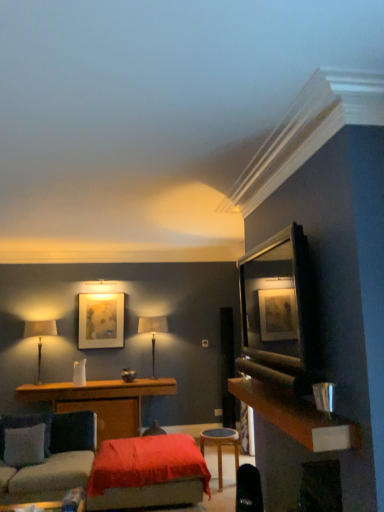
This screenshot has width=384, height=512. What do you see at coordinates (221, 446) in the screenshot? I see `wooden stool at center, marked as the second table in a left-to-right arrangement` at bounding box center [221, 446].

Describe the element at coordinates (24, 445) in the screenshot. This screenshot has width=384, height=512. I see `white fabric pillow at lower left` at that location.

This screenshot has height=512, width=384. Describe the element at coordinates (101, 401) in the screenshot. I see `wooden table at center, which is the 2th table in right-to-left order` at that location.

What do you see at coordinates (45, 455) in the screenshot? The height and width of the screenshot is (512, 384). I see `velvet blue couch at lower left` at bounding box center [45, 455].

The width and height of the screenshot is (384, 512). Describe the element at coordinates (278, 302) in the screenshot. I see `wooden framed mirror at upper right` at that location.

What is the approximate width of matte beige table lamp at left, positioned as the 1th table lamp in left-to-right order?

It is 25.21 centimeters.

The height and width of the screenshot is (512, 384). Describe the element at coordinates (147, 473) in the screenshot. I see `velvet red ottoman at center` at that location.

In order to click on wooden stool at center, the 1th table viewed from the front in this screenshot , I will do `click(221, 446)`.

Is white fabric pillow at lower left inside or outside of velvet blue couch at lower left?

white fabric pillow at lower left lies within the bounds of velvet blue couch at lower left.

Can you tell me how much white fabric pillow at lower left and velvet blue couch at lower left differ in facing direction?

The angle between the facing direction of white fabric pillow at lower left and the facing direction of velvet blue couch at lower left is 81 degrees.

Considering the relative positions of white fabric pillow at lower left and velvet blue couch at lower left in the image provided, is white fabric pillow at lower left to the left or to the right of velvet blue couch at lower left?

Clearly, white fabric pillow at lower left is on the left of velvet blue couch at lower left in the image.

From a real-world perspective, is white fabric pillow at lower left positioned under velvet blue couch at lower left based on gravity?

Actually, white fabric pillow at lower left is physically above velvet blue couch at lower left in the real world.

Which is more to the right, wooden stool at center, the second table when ordered from back to front, or wooden framed mirror at upper right?

wooden framed mirror at upper right.

From a real-world perspective, is wooden stool at center, marked as the second table in a left-to-right arrangement, on top of wooden framed mirror at upper right?

No, from a real-world perspective, wooden stool at center, marked as the second table in a left-to-right arrangement, is not above wooden framed mirror at upper right.

Considering the positions of points (208, 438) and (271, 354), is point (208, 438) closer to camera compared to point (271, 354)?

No.

Can you see wooden stool at center, marked as the second table in a left-to-right arrangement, touching wooden table at center, positioned as the second table in front-to-back order?

No, wooden stool at center, marked as the second table in a left-to-right arrangement, is not making contact with wooden table at center, positioned as the second table in front-to-back order.

Based on their sizes in the image, would you say wooden stool at center, the second table when ordered from back to front, is bigger or smaller than wooden table at center, which appears as the first table when viewed from the back?

Clearly, wooden stool at center, the second table when ordered from back to front, is smaller in size than wooden table at center, which appears as the first table when viewed from the back.

Considering the points (236, 454) and (135, 419), which point is in front, point (236, 454) or point (135, 419)?

The point (236, 454) is closer.

Considering the positions of objects wooden stool at center, the 1th table viewed from the front, and wooden table at center, which is counted as the 1th table, starting from the left, in the image provided, who is in front, wooden stool at center, the 1th table viewed from the front, or wooden table at center, which is counted as the 1th table, starting from the left,?

Positioned in front is wooden stool at center, the 1th table viewed from the front.

Does velvet blue couch at lower left have a lesser height compared to wooden stool at center, the 1th table viewed from the front?

No.

Does velvet blue couch at lower left have a larger size compared to wooden stool at center, the 1th table viewed from the front?

Yes, velvet blue couch at lower left is bigger than wooden stool at center, the 1th table viewed from the front.

Is velvet blue couch at lower left beside wooden stool at center, the 1th table viewed from the front?

There is a gap between velvet blue couch at lower left and wooden stool at center, the 1th table viewed from the front.

At what (x,y) coordinates should I click in order to perform the action: click on table that is the 1st one when counting backward from the velvet blue couch at lower left. Please return your answer as a coordinate pair (x, y). Image resolution: width=384 pixels, height=512 pixels. Looking at the image, I should click on [x=221, y=446].

Would you say wooden dresser at right contains velvet blue couch at lower left?

No, velvet blue couch at lower left is not surrounded by wooden dresser at right.

Is point (255, 399) positioned after point (29, 426)?

No.

From the picture: Is wooden dresser at right oriented towards velvet blue couch at lower left?

No, wooden dresser at right is not facing towards velvet blue couch at lower left.

Which is behind, velvet blue couch at lower left or wooden dresser at right?

wooden dresser at right is further away from the camera.

From a real-world perspective, is velvet blue couch at lower left on wooden dresser at right?

No, from a real-world perspective, velvet blue couch at lower left is not above wooden dresser at right.

Between velvet blue couch at lower left and wooden dresser at right, which one has more height?

velvet blue couch at lower left.

Is matte gold picture frame at upper center outside of matte beige table lamp at left, positioned as the 1th table lamp in left-to-right order?

Indeed, matte gold picture frame at upper center is completely outside matte beige table lamp at left, positioned as the 1th table lamp in left-to-right order.

From the image's perspective, which one is positioned lower, matte gold picture frame at upper center or matte beige table lamp at left, which is counted as the second table lamp, starting from the right?

matte beige table lamp at left, which is counted as the second table lamp, starting from the right, from the image's perspective.

Between matte gold picture frame at upper center and matte beige table lamp at left, which is counted as the second table lamp, starting from the right, which one has larger size?

With larger size is matte beige table lamp at left, which is counted as the second table lamp, starting from the right.

In terms of height, does matte gold picture frame at upper center look taller or shorter compared to matte beige table lamp at left, which is counted as the second table lamp, starting from the right?

Clearly, matte gold picture frame at upper center is shorter compared to matte beige table lamp at left, which is counted as the second table lamp, starting from the right.

The height and width of the screenshot is (512, 384). Identify the location of studio couch above the white fabric pillow at lower left (from the image's perspective). (45, 455).

Where is `shelf positioned vertically above the wooden stool at center, the 1th table viewed from the front (from a real-world perspective)`? This screenshot has width=384, height=512. shelf positioned vertically above the wooden stool at center, the 1th table viewed from the front (from a real-world perspective) is located at coordinates (278, 302).

From the image, which object appears to be nearer to white fabric pillow at lower left, matte gold picture frame at upper center or wooden stool at center, the 1th table from the right?

The object closer to white fabric pillow at lower left is matte gold picture frame at upper center.

Estimate the real-world distances between objects in this image. Which object is further from wooden dresser at right, matte gold picture frame at upper center or white fabric pillow at lower left?

matte gold picture frame at upper center is positioned further to the anchor wooden dresser at right.

Based on the photo, looking at the image, which one is located further to matte gold picture frame at upper center, matte beige table lamp at left, which is counted as the second table lamp, starting from the right, or wooden table at center, positioned as the second table in front-to-back order?

The object further to matte gold picture frame at upper center is wooden table at center, positioned as the second table in front-to-back order.

From the image, which object appears to be nearer to velvet blue couch at lower left, wooden table at center, which is counted as the 1th table, starting from the left, or wooden dresser at right?

wooden table at center, which is counted as the 1th table, starting from the left.

Considering their positions, is wooden table at center, which is the 2th table in right-to-left order, positioned further to wooden dresser at right than matte black table lamp at center, the 1th table lamp viewed from the right?

Based on the image, matte black table lamp at center, the 1th table lamp viewed from the right, appears to be further to wooden dresser at right.

Looking at the image, which one is located closer to wooden dresser at right, wooden stool at center, the 1th table viewed from the front, or wooden table at center, which is counted as the 1th table, starting from the left?

Among the two, wooden stool at center, the 1th table viewed from the front, is located nearer to wooden dresser at right.

Looking at the image, which one is located closer to wooden stool at center, the 1th table viewed from the front, velvet red ottoman at center or matte beige table lamp at left, positioned as the 1th table lamp in left-to-right order?

velvet red ottoman at center.

From the picture: Estimate the real-world distances between objects in this image. Which object is further from wooden table at center, which is the 2th table in right-to-left order, white fabric pillow at lower left or matte beige table lamp at left, which is counted as the second table lamp, starting from the right?

white fabric pillow at lower left is positioned further to the anchor wooden table at center, which is the 2th table in right-to-left order.

Where is `dresser located between velvet blue couch at lower left and wooden stool at center, marked as the second table in a left-to-right arrangement, in the depth direction`? dresser located between velvet blue couch at lower left and wooden stool at center, marked as the second table in a left-to-right arrangement, in the depth direction is located at coordinates (297, 418).

At what (x,y) coordinates should I click in order to perform the action: click on table between wooden stool at center, the 1th table viewed from the front, and matte black table lamp at center, positioned as the second table lamp in left-to-right order, from front to back. Please return your answer as a coordinate pair (x, y). Looking at the image, I should click on (101, 401).

Where is `bed located between wooden framed mirror at upper right and wooden stool at center, the second table when ordered from back to front, in the depth direction`? bed located between wooden framed mirror at upper right and wooden stool at center, the second table when ordered from back to front, in the depth direction is located at coordinates (147, 473).

Locate an element on the screen. This screenshot has height=512, width=384. table lamp between wooden framed mirror at upper right and matte black table lamp at center, the 1th table lamp viewed from the right, in the front-back direction is located at coordinates (40, 336).